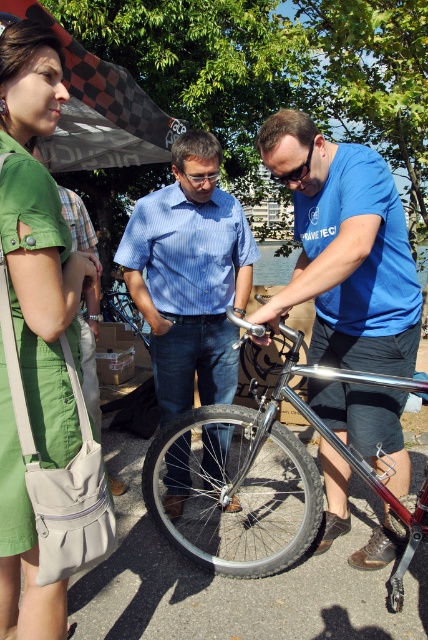
Question: Which of the following is the closest to the observer?

Choices:
 (A) shiny metallic bicycle at center
 (B) blue striped shirt at center
 (C) green cotton dress at upper left
 (D) black rubber tire at center

Answer: (C)

Question: Can you confirm if blue matte shirt at center is wider than shiny metallic bicycle at center?

Choices:
 (A) no
 (B) yes

Answer: (A)

Question: Does green cotton dress at upper left have a larger size compared to shiny metallic bicycle at center?

Choices:
 (A) no
 (B) yes

Answer: (A)

Question: Among these points, which one is nearest to the camera?

Choices:
 (A) (282, 484)
 (B) (38, 336)

Answer: (B)

Question: Considering the real-world distances, which object is farthest from the shiny metallic bicycle at center?

Choices:
 (A) blue matte shirt at center
 (B) green cotton dress at upper left

Answer: (B)

Question: Does green cotton dress at upper left appear on the right side of blue striped shirt at center?

Choices:
 (A) no
 (B) yes

Answer: (A)